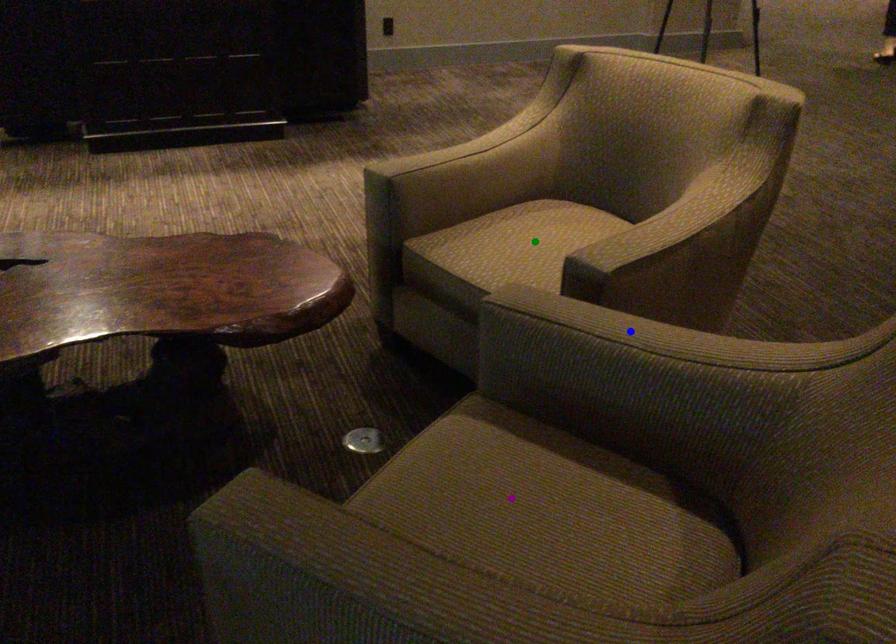
Order these from farthest to nearest:
blue point | green point | purple point

green point < blue point < purple point